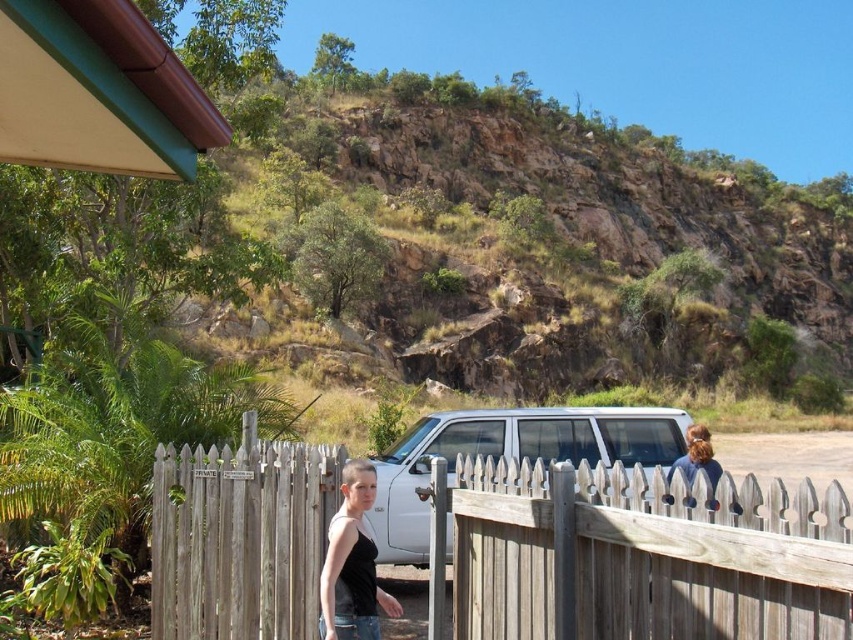
Consider the image. You are standing at the fence gate and want to determine which of the two points, point (612, 472) or point (699, 451), is closer to you. Based on the scene, which point is nearer?

Point (612, 472) is closer to the viewer than point (699, 451).

You are a delivery person trying to locate the address on the property. You see a black matte tank top at center and a dark brown hair at upper right. Which direction should you walk to reach the sign that says PRIVATE?

The black matte tank top at center is to the left of dark brown hair at upper right. Since the sign is on the fence near the gate, you should walk towards the direction of the dark brown hair at upper right to reach the sign that says PRIVATE.